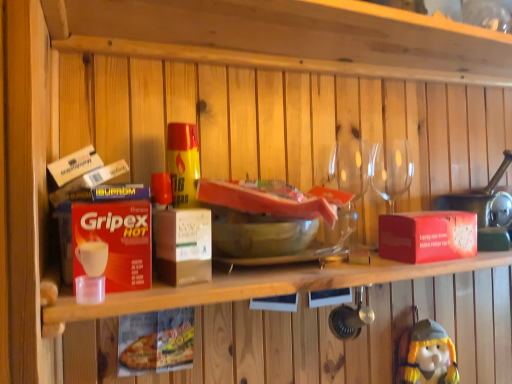
Question: From the image's perspective, relative to transparent glass wine glasses at upper right, is red cardboard box at upper center, the second shelf positioned from the top, above or below?

Choices:
 (A) above
 (B) below

Answer: (B)

Question: Considering the positions of point (373, 256) and point (385, 190), is point (373, 256) closer or farther from the camera than point (385, 190)?

Choices:
 (A) closer
 (B) farther

Answer: (A)

Question: Estimate the real-world distances between objects in this image. Which object is farther from the red matte gripex hot at left, the second box positioned from the right?

Choices:
 (A) red cardboard box at upper center, the second shelf positioned from the top
 (B) wooden at upper center, the second shelf in the bottom-to-top sequence
 (C) yellow plush toy at lower right
 (D) transparent glass wine glasses at upper right
 (E) red matte box at right, which is the second box in left-to-right order

Answer: (C)

Question: Which is nearer to the wooden at upper center, the second shelf in the bottom-to-top sequence?

Choices:
 (A) red matte box at right, which is the second box in left-to-right order
 (B) red cardboard box at upper center, the second shelf positioned from the top
 (C) transparent glass wine glasses at upper right
 (D) yellow plush toy at lower right
 (E) red matte gripex hot at left, the 1th box from the front

Answer: (C)